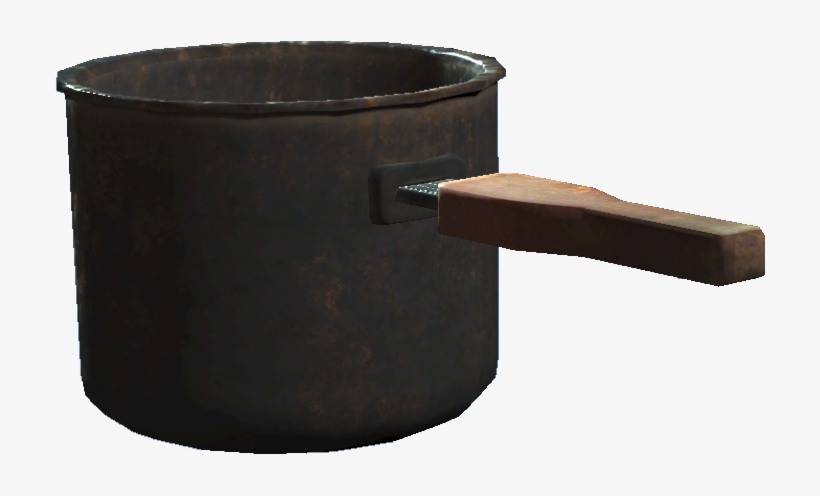
This screenshot has height=496, width=820. Find the location of `pot in middle of picture`. pot in middle of picture is located at coordinates (347, 267).